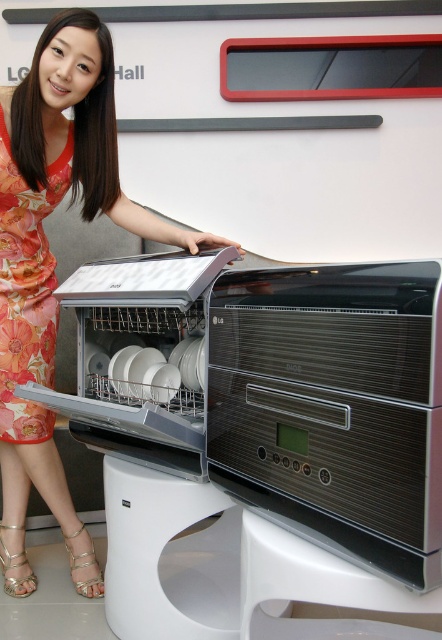
Can you confirm if metallic silver dishwasher at center is shorter than floral dress at center?

Indeed, metallic silver dishwasher at center has a lesser height compared to floral dress at center.

This screenshot has height=640, width=442. Identify the location of metallic silver dishwasher at center. (274, 392).

Between point (426, 268) and point (38, 156), which one is positioned in front?

Point (426, 268) is more forward.

This screenshot has width=442, height=640. I want to click on metallic silver dishwasher at center, so click(274, 392).

Where is `metallic silver dishwasher at center`? The width and height of the screenshot is (442, 640). metallic silver dishwasher at center is located at coordinates (274, 392).

Does metallic silver dishwasher at center appear over white plastic stool at lower center?

Indeed, metallic silver dishwasher at center is positioned over white plastic stool at lower center.

Is point (129, 342) behind point (335, 634)?

Yes.

I want to click on metallic silver dishwasher at center, so click(274, 392).

Who is more forward, (218, 380) or (42, 198)?

Point (218, 380)

Is metallic silver dishwasher at center wider than floral silk dress at left?

Indeed, metallic silver dishwasher at center has a greater width compared to floral silk dress at left.

Locate an element on the screen. metallic silver dishwasher at center is located at coordinates (274, 392).